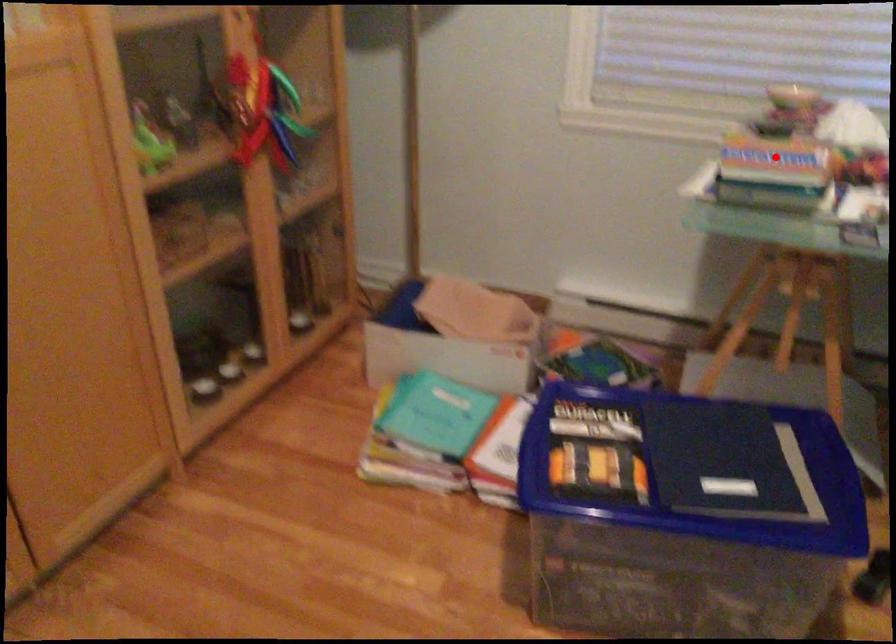
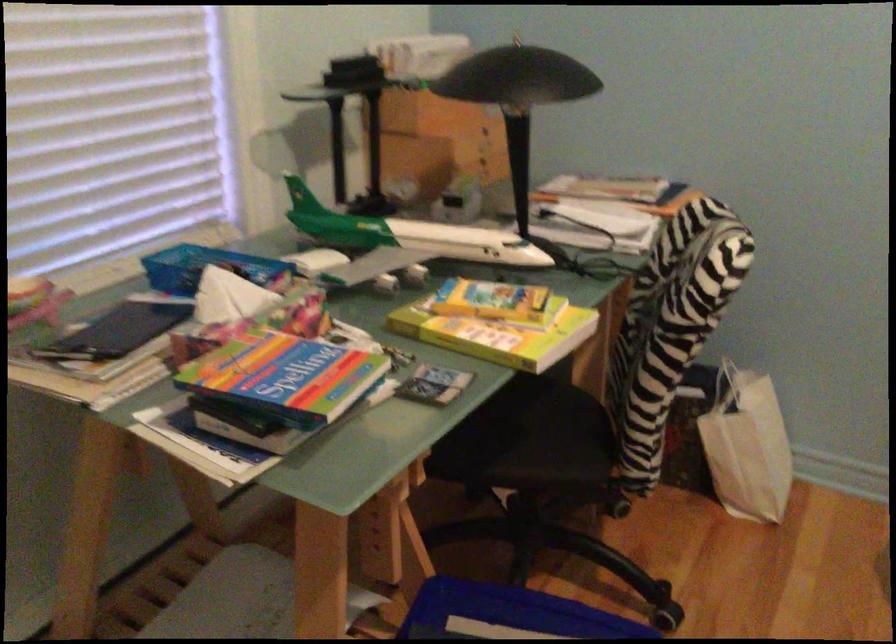
Question: I am providing you with two images of the same scene from different viewpoints. Image1 has a red point marked. In image2, the corresponding 3D location appears at what relative position? Reply with the corresponding letter.

Choices:
 (A) Closer
 (B) Farther

Answer: (A)